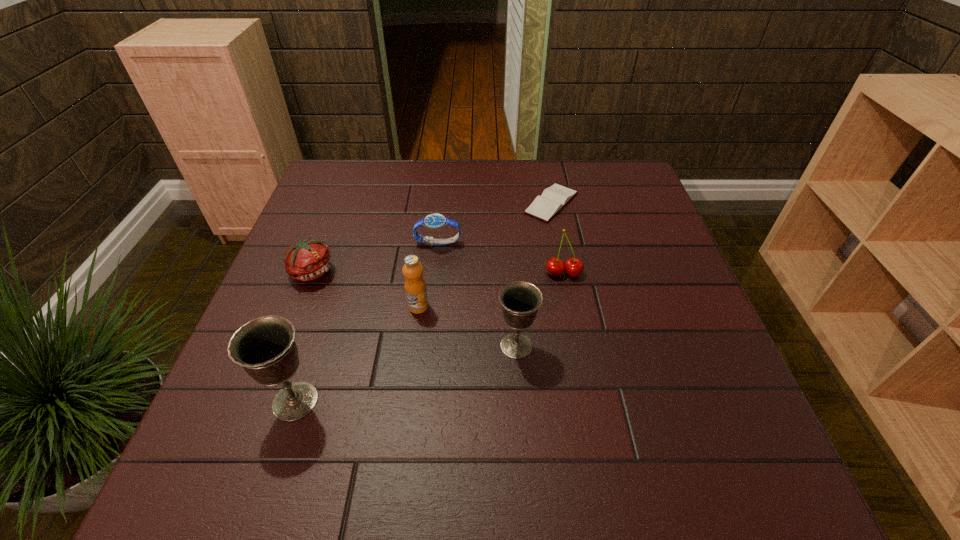
Please point a spot to add another chalice on the right. Please provide its 2D coordinates. Your answer should be formatted as a tuple, i.e. [(x, y)], where the tuple contains the x and y coordinates of a point satisfying the conditions above.

[(698, 300)]